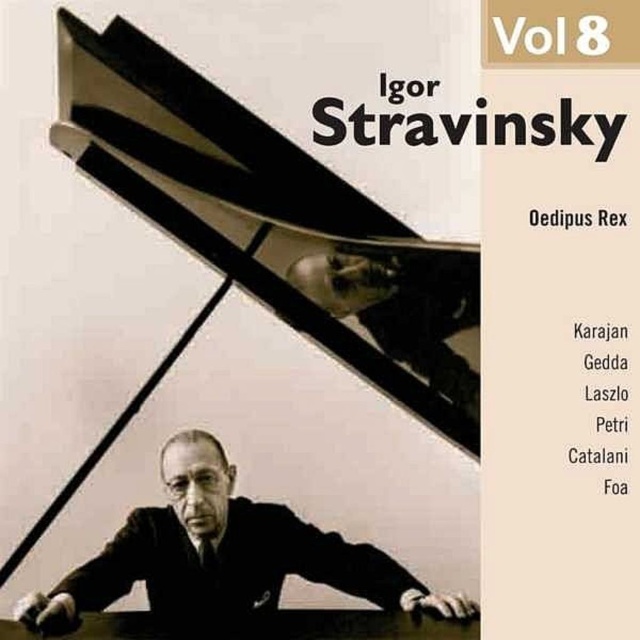
You are a photographer analyzing this album cover. You notice two points marked on the image. The first point is at coordinates point (120,580) and the second is at point (433,285). Which of these points is closer to the camera?

Point (120,580) is further to the camera than point (433,285). Therefore, point (433,285) is closer to the camera.

You are an art curator examining this album cover. There are two points marked on the image, one at coordinates point (118, 51) and another at point (380, 328). Which point is nearer to you as you look at the cover?

Point (118, 51) is closer to the viewer than point (380, 328).

Where is the black polished piano at center located in the image?

The black polished piano at center is located at point 0.347 on the x axis and 0.428 on the y axis.